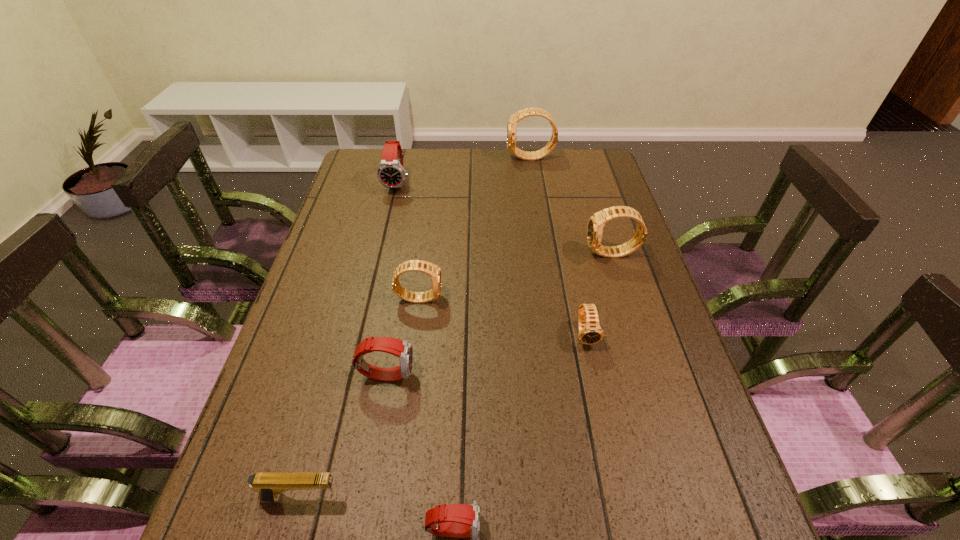
Locate an element on the screen. The width and height of the screenshot is (960, 540). vacant region located 0.210m on the face of the second farthest watch is located at coordinates (386, 237).

This screenshot has height=540, width=960. Find the location of `free space located 0.150m on the face of the fourth farthest watch`. free space located 0.150m on the face of the fourth farthest watch is located at coordinates (500, 298).

Identify the location of free space located 0.200m on the face of the sixth farthest watch. This screenshot has width=960, height=540. (504, 374).

In order to click on vacant space located 0.100m at the barrel of the second nearest object in this screenshot , I will do `click(396, 498)`.

Where is `vacant space situated on the face of the smallest black watch`? vacant space situated on the face of the smallest black watch is located at coordinates (604, 418).

Where is `watch present at the left edge`? This screenshot has width=960, height=540. watch present at the left edge is located at coordinates (391, 174).

You are a GUI agent. You are given a task and a screenshot of the screen. Output one action in this format:
    pyautogui.click(x=<x>, y=<y>)
    Task: Click on the pistol that is positioned at the left edge
    This screenshot has height=540, width=960.
    Given the screenshot: What is the action you would take?
    pos(270,485)

Identify the location of object present at the right edge. This screenshot has width=960, height=540. (596, 223).

You are a GUI agent. You are given a task and a screenshot of the screen. Output one action in this format:
    pyautogui.click(x=<x>, y=<y>)
    Task: Click on the object that is at the far left corner
    The width and height of the screenshot is (960, 540).
    Given the screenshot: What is the action you would take?
    pyautogui.click(x=391, y=174)

In the image, there is a desktop. Where is `vacant space at the far edge`? The image size is (960, 540). vacant space at the far edge is located at coordinates (461, 181).